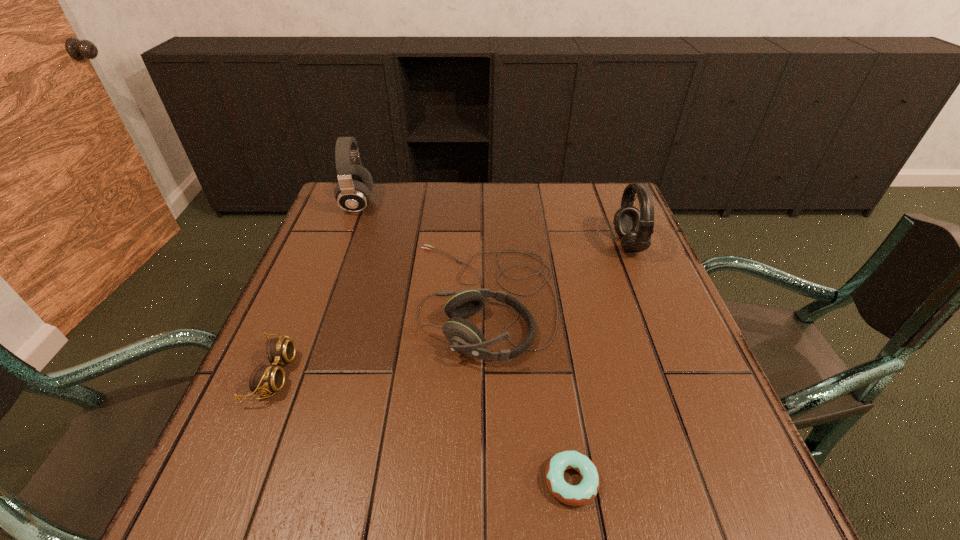
Where is `free space between the doughnut and the second headset from right to left`? free space between the doughnut and the second headset from right to left is located at coordinates (528, 390).

The width and height of the screenshot is (960, 540). Find the location of `free space between the rightmost object and the nearest object`. free space between the rightmost object and the nearest object is located at coordinates (600, 363).

You are a GUI agent. You are given a task and a screenshot of the screen. Output one action in this format:
    pyautogui.click(x=<x>, y=<y>)
    Task: Click on the vacant region between the goggles and the farthest object
    
    Given the screenshot: What is the action you would take?
    pyautogui.click(x=316, y=289)

What are the coordinates of `free spot between the second headset from right to left and the second tallest object` in the screenshot? It's located at (556, 272).

The image size is (960, 540). In order to click on empty space between the fourth shortest object and the third shortest object in this screenshot , I will do `click(556, 272)`.

This screenshot has width=960, height=540. In order to click on vacant region between the shortest headset and the goggles in this screenshot , I will do pos(379,337).

Select which object appears as the third closest to the fourth tallest object. Please provide its 2D coordinates. Your answer should be formatted as a tuple, i.e. [(x, y)], where the tuple contains the x and y coordinates of a point satisfying the conditions above.

[(574, 495)]

Where is `the fourth closest object to the nearest object`? the fourth closest object to the nearest object is located at coordinates (353, 192).

Identify which headset is the nearest to the tallest headset. Please provide its 2D coordinates. Your answer should be formatted as a tuple, i.e. [(x, y)], where the tuple contains the x and y coordinates of a point satisfying the conditions above.

[(464, 336)]

Identify which headset is the second closest to the farthest object. Please provide its 2D coordinates. Your answer should be formatted as a tuple, i.e. [(x, y)], where the tuple contains the x and y coordinates of a point satisfying the conditions above.

[(635, 227)]